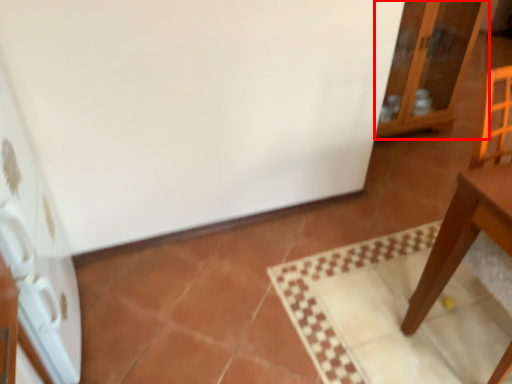
Question: From the image, what is the correct spatial relationship of cabinetry (annotated by the red box) in relation to appliance?

Choices:
 (A) left
 (B) right

Answer: (B)